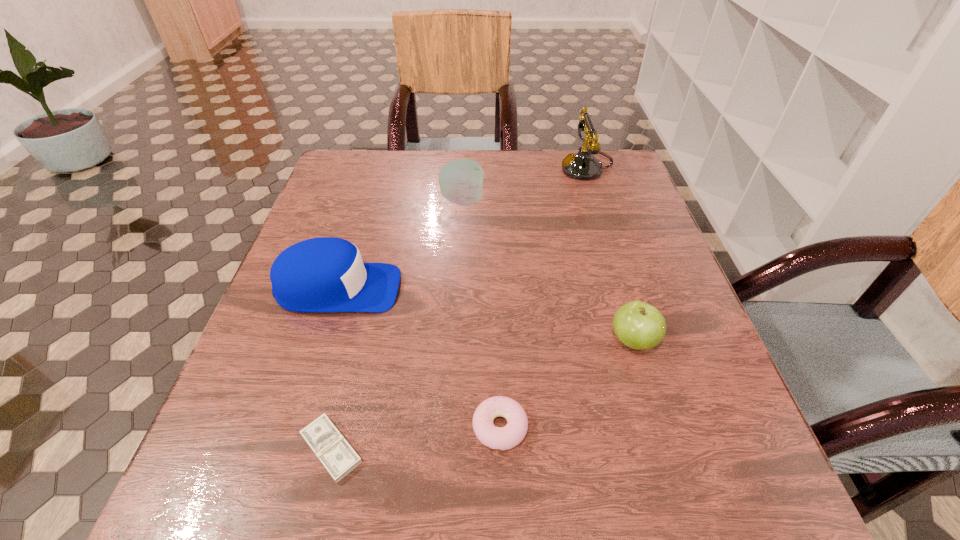
Find the location of `vacant area that satisfies the following two spatial constraints: 1. on the front side of the nearer apple; 2. on the right side of the farther apple`. vacant area that satisfies the following two spatial constraints: 1. on the front side of the nearer apple; 2. on the right side of the farther apple is located at coordinates (455, 341).

You are a GUI agent. You are given a task and a screenshot of the screen. Output one action in this format:
    pyautogui.click(x=<x>, y=<y>)
    Task: Click on the free space that satisfies the following two spatial constraints: 1. on the front side of the farther apple; 2. on the left side of the shorter apple
    
    Given the screenshot: What is the action you would take?
    pyautogui.click(x=455, y=341)

This screenshot has height=540, width=960. Identify the location of free point that satisfies the following two spatial constraints: 1. on the front-facing side of the shortest object; 2. on the right side of the third farthest object. (288, 449).